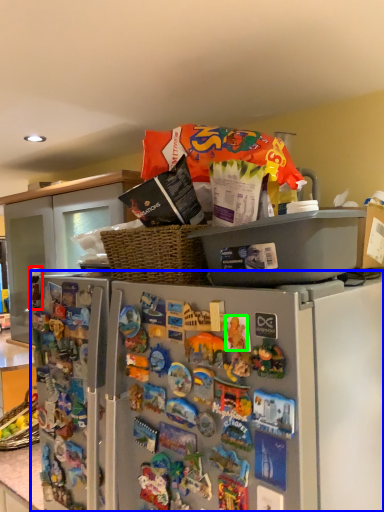
Question: Estimate the real-world distances between objects in this image. Which object is farther from toy (highlighted by a red box), refrigerator (highlighted by a blue box) or toy (highlighted by a green box)?

Choices:
 (A) refrigerator
 (B) toy

Answer: (B)